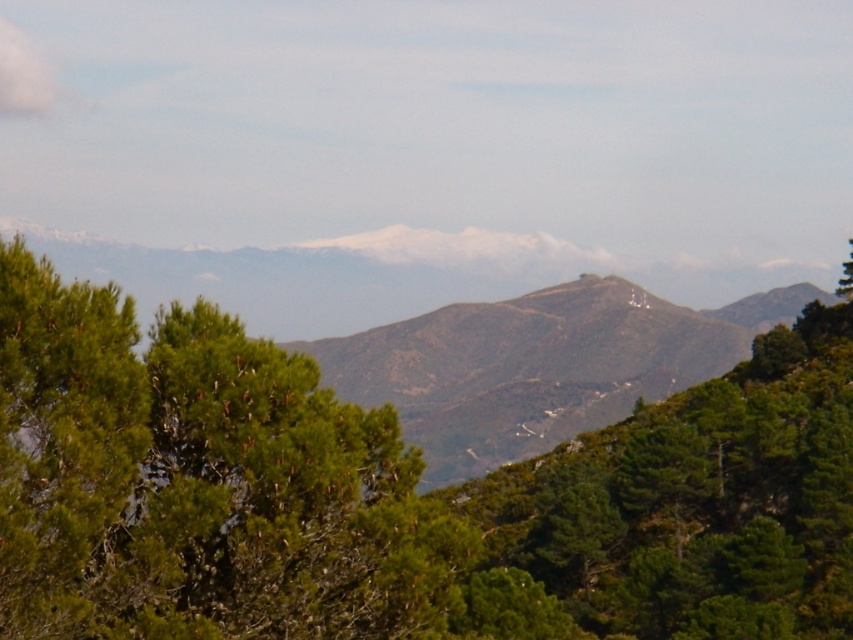
Is white fluffy cloud at upper left shorter than green leafy tree at upper right?

No, white fluffy cloud at upper left is not shorter than green leafy tree at upper right.

Which is behind, point (20, 60) or point (849, 296)?

Point (20, 60)

Does point (10, 24) lie behind point (846, 260)?

Yes.

The width and height of the screenshot is (853, 640). Find the location of `white fluffy cloud at upper left`. white fluffy cloud at upper left is located at coordinates (22, 74).

Looking at this image, is green leafy tree at center bigger than white fluffy cloud at upper left?

Yes.

What do you see at coordinates (396, 493) in the screenshot?
I see `green leafy tree at center` at bounding box center [396, 493].

You are a GUI agent. You are given a task and a screenshot of the screen. Output one action in this format:
    pyautogui.click(x=<x>, y=<y>)
    Task: Click on the green leafy tree at center
    The width and height of the screenshot is (853, 640).
    Given the screenshot: What is the action you would take?
    pyautogui.click(x=396, y=493)

Does point (164, 584) come in front of point (851, 284)?

That is True.

From the picture: Who is positioned more to the right, green leafy tree at center or green leafy tree at upper right?

Positioned to the right is green leafy tree at upper right.

Between point (42, 467) and point (844, 280), which one is positioned behind?

Point (844, 280)

The width and height of the screenshot is (853, 640). I want to click on green leafy tree at center, so click(396, 493).